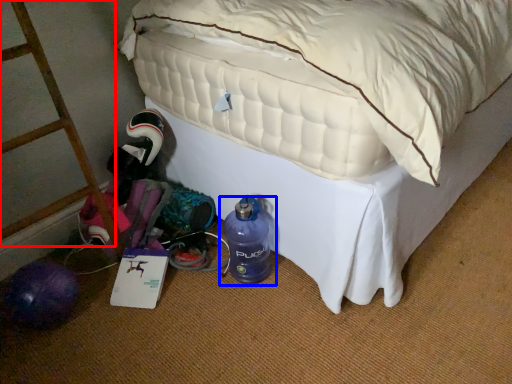
Question: Which of the following is the farthest to the observer, ladder (highlighted by a red box) or bottle (highlighted by a blue box)?

Choices:
 (A) ladder
 (B) bottle

Answer: (B)